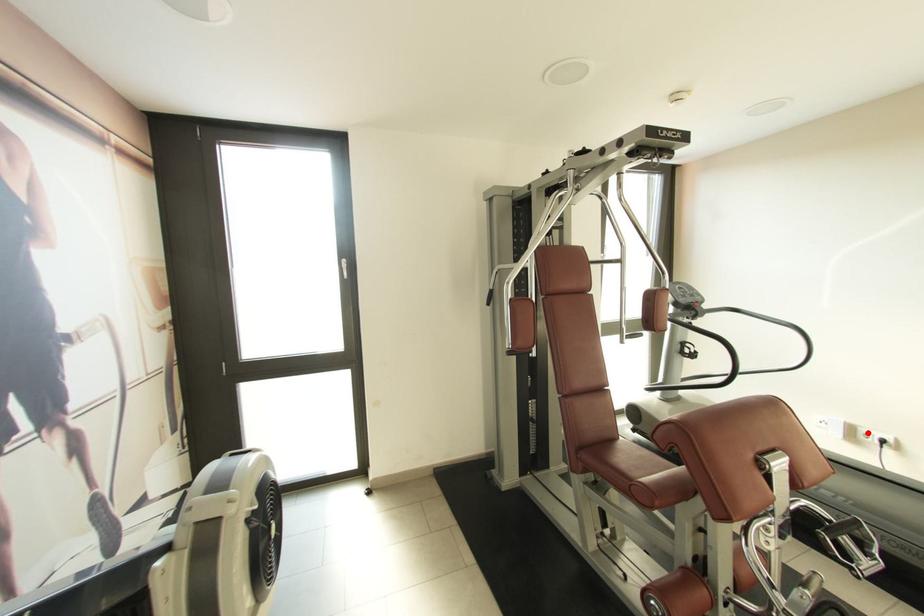
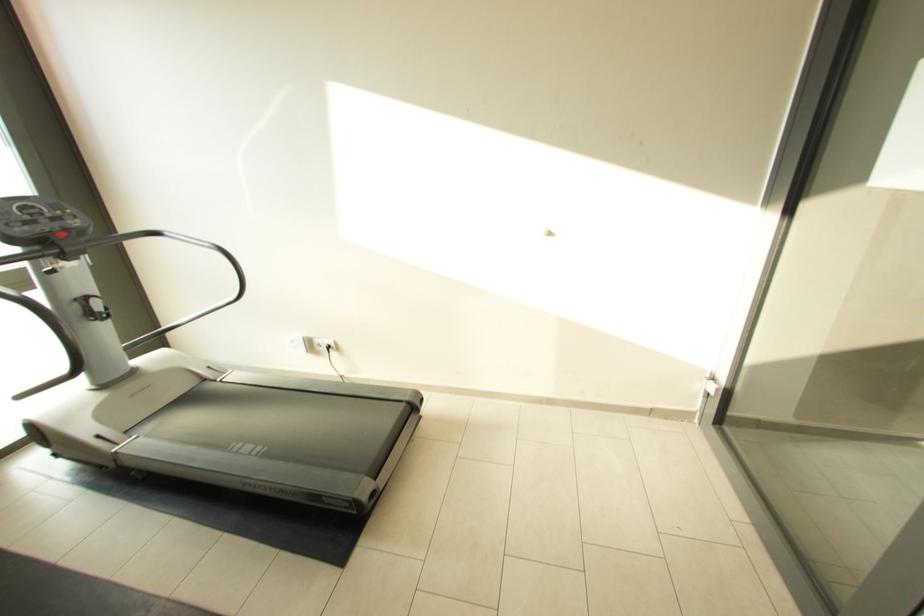
Question: I am providing you with two images of the same scene from different viewpoints. In image1, a red point is highlighted. Considering the same 3D point in image2, which of the following is correct?

Choices:
 (A) It is closer
 (B) It is farther

Answer: (B)